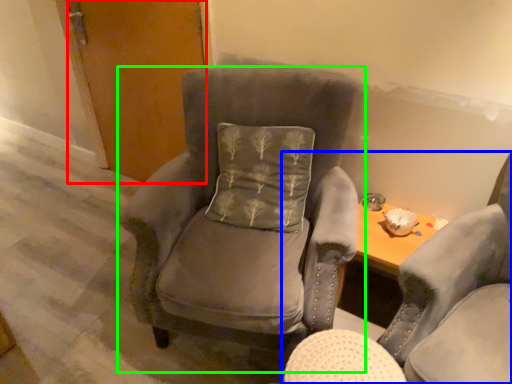
Question: Estimate the real-world distances between objects in this image. Which object is farther from door (highlighted by a red box), chair (highlighted by a blue box) or chair (highlighted by a green box)?

Choices:
 (A) chair
 (B) chair

Answer: (A)